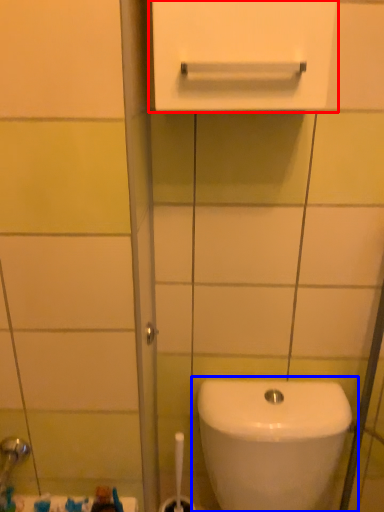
Question: Which point is further to the camera, medicine cabinet (highlighted by a red box) or toilet (highlighted by a blue box)?

Choices:
 (A) medicine cabinet
 (B) toilet

Answer: (B)